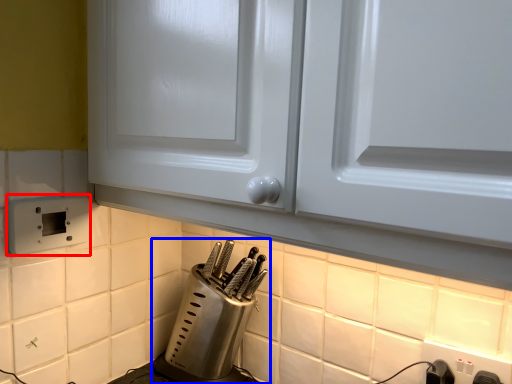
Question: Which of the following is the closest to the observer, electric outlet (highlighted by a red box) or kitchen appliance (highlighted by a blue box)?

Choices:
 (A) electric outlet
 (B) kitchen appliance

Answer: (A)